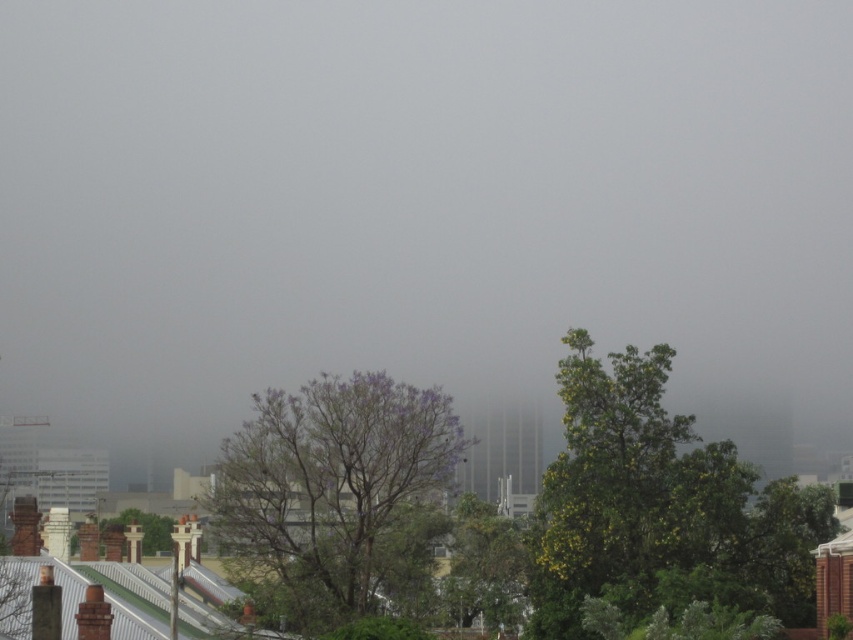
You are standing in the urban landscape described and want to locate the brown textured chimney at lower left. Which direction should you face to see it relative to the purple leafy tree at center?

The purple leafy tree at center is to the right of the brown textured chimney at lower left, so you should face towards the left side of the purple leafy tree at center to see the brown textured chimney at lower left.

You are a city planner evaluating the urban landscape. You need to determine if the green leafy tree at right will block sunlight to the brown textured chimney at lower left. Based on their relative heights, what is your assessment?

The green leafy tree at right is much taller than the brown textured chimney at lower left, so it is likely that the tree will block sunlight to the chimney.

You are standing at the center of the image and want to locate the green leafy tree at right. According to the coordinates provided, in which direction should you move to face it?

The green leafy tree at right is located at coordinates point (659, 508). Since you are at the center, you should move towards the right and slightly upward to face it.